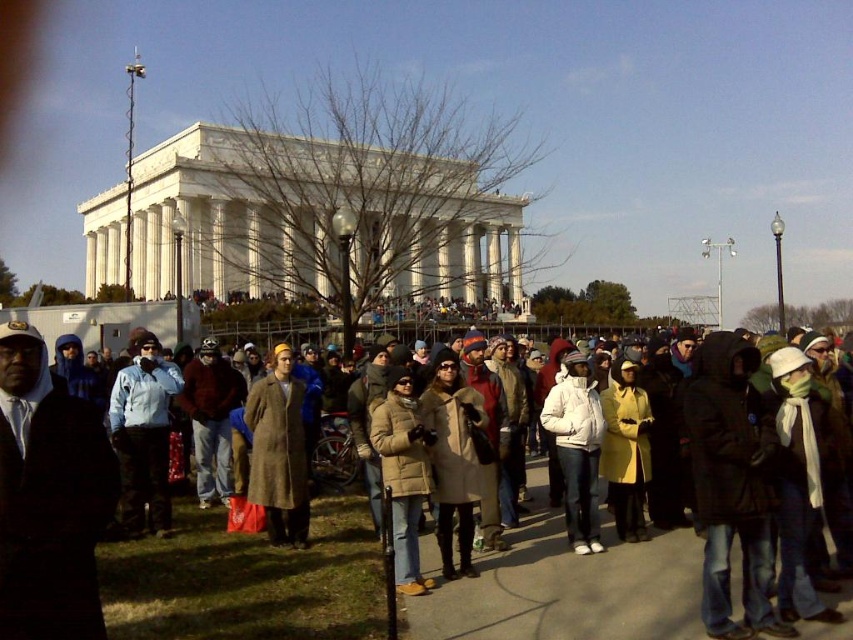
Question: Does light brown coat at center have a smaller size compared to brown wool coat at center?

Choices:
 (A) no
 (B) yes

Answer: (A)

Question: Among these points, which one is farthest from the camera?

Choices:
 (A) (639, 588)
 (B) (276, 464)
 (C) (579, 392)

Answer: (C)

Question: Among these points, which one is farthest from the camera?

Choices:
 (A) (270, 413)
 (B) (646, 592)

Answer: (A)

Question: Among these objects, which one is nearest to the camera?

Choices:
 (A) brown wool coat at center
 (B) white matte jacket at center
 (C) light brown coat at center

Answer: (C)

Question: Does brown wool coat at center have a larger size compared to white matte jacket at center?

Choices:
 (A) no
 (B) yes

Answer: (B)

Question: In this image, where is light brown coat at center located relative to white matte jacket at center?

Choices:
 (A) above
 (B) below

Answer: (B)